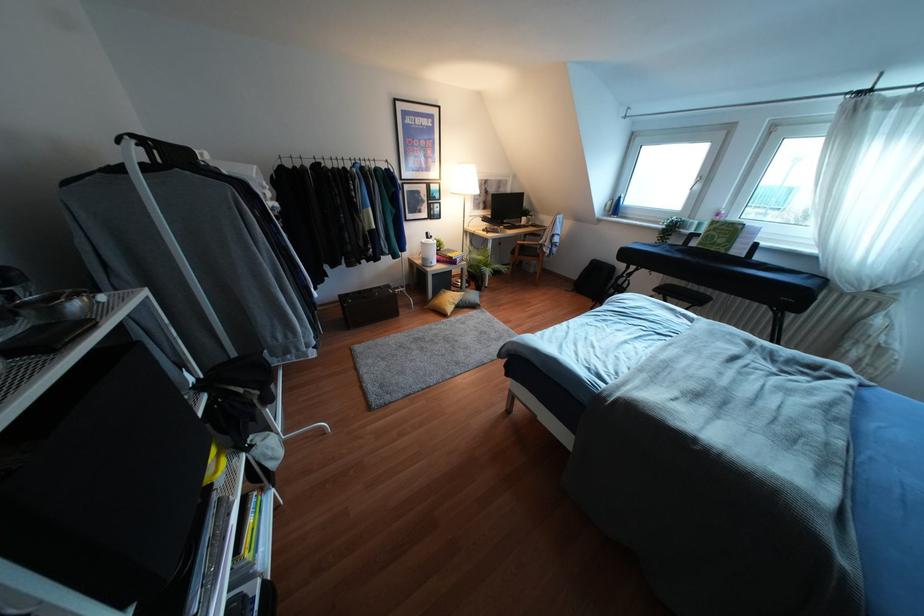
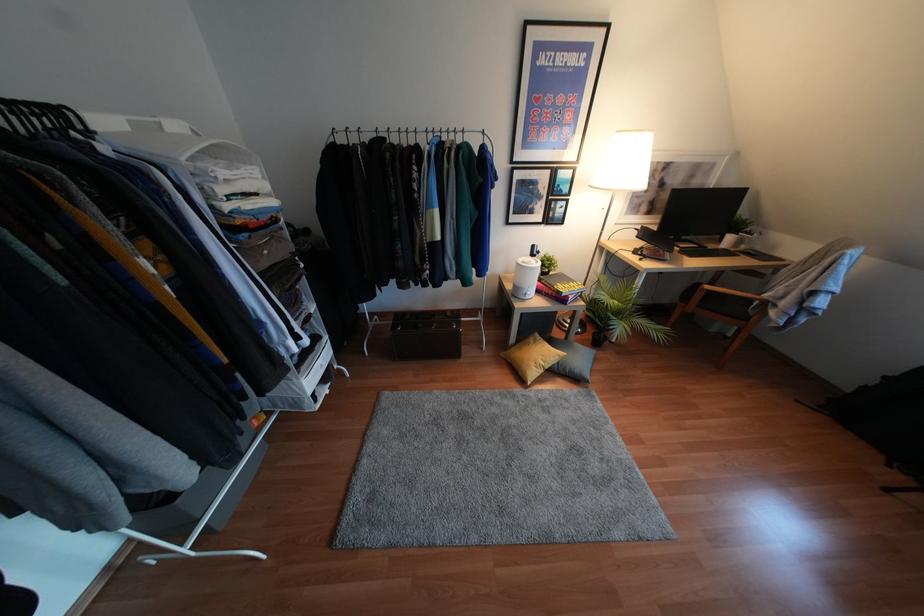
Locate, in the second image, the point that corresponds to pixel 537 256 in the first image.

(745, 318)